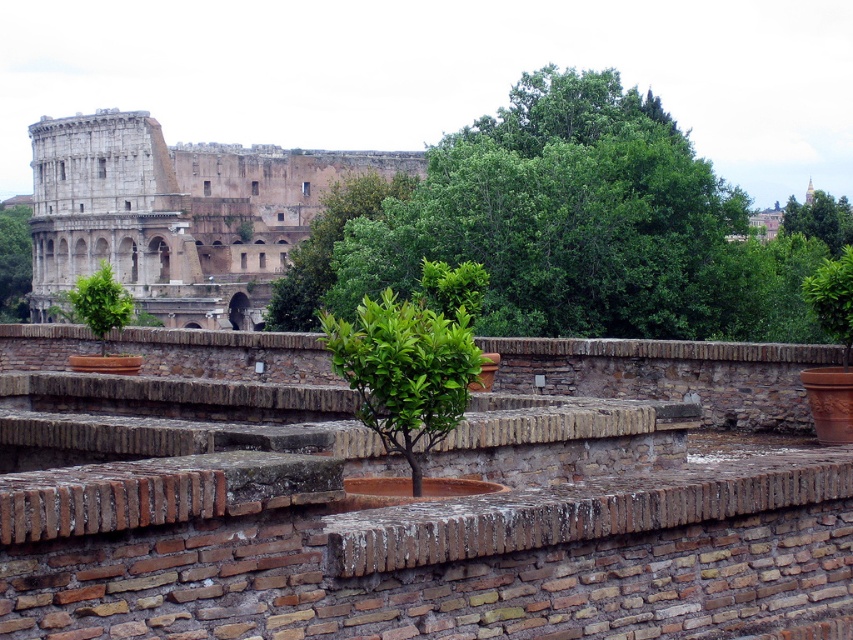
Question: Can you confirm if green leafy tree at left is wider than green matte plant at left?

Choices:
 (A) no
 (B) yes

Answer: (A)

Question: Which object is closer to the camera taking this photo?

Choices:
 (A) stone amphitheater at upper left
 (B) green leafy tree at left
 (C) green matte plant at left

Answer: (C)

Question: Is green leafy tree at left above green matte plant at left?

Choices:
 (A) no
 (B) yes

Answer: (B)

Question: In this image, where is green leafy tree at center located relative to green leafy tree at left?

Choices:
 (A) above
 (B) below

Answer: (B)

Question: Among these points, which one is farthest from the camera?

Choices:
 (A) 456,163
 (B) 3,250

Answer: (B)

Question: Which point is farther to the camera?

Choices:
 (A) (73, 278)
 (B) (128, 316)
 (C) (560, 248)

Answer: (A)